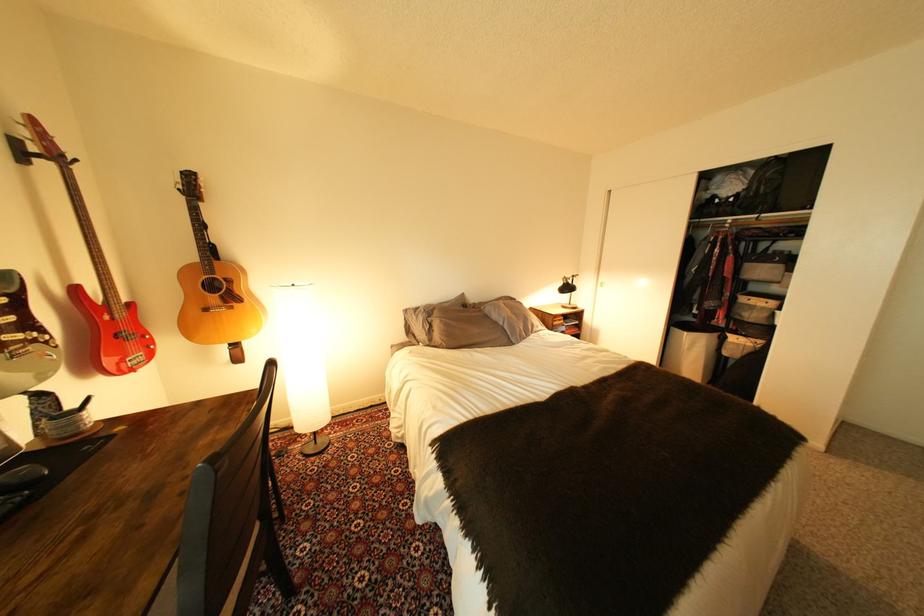
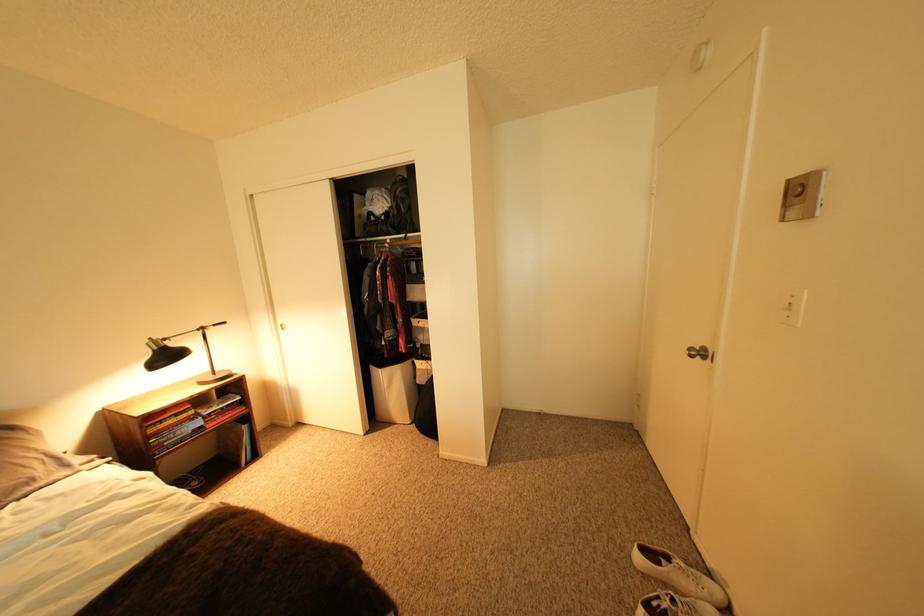
In the second image, find the point that corresponds to point (698, 334) in the first image.

(393, 371)